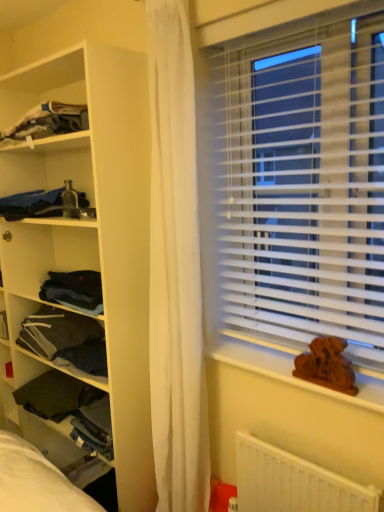
Find the location of a particular element. The image size is (384, 512). free point above wooden carving at lower right (from a real-world perspective) is located at coordinates (283, 362).